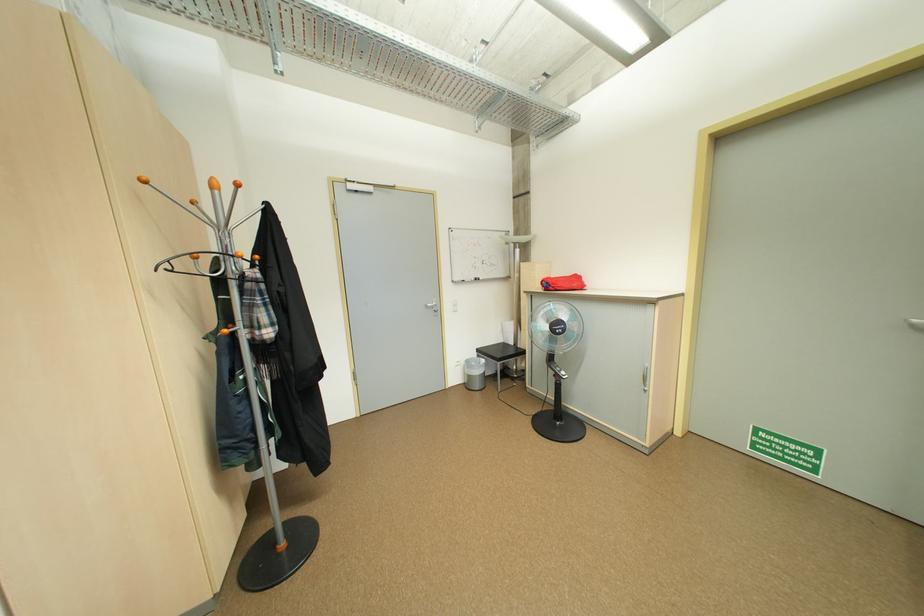
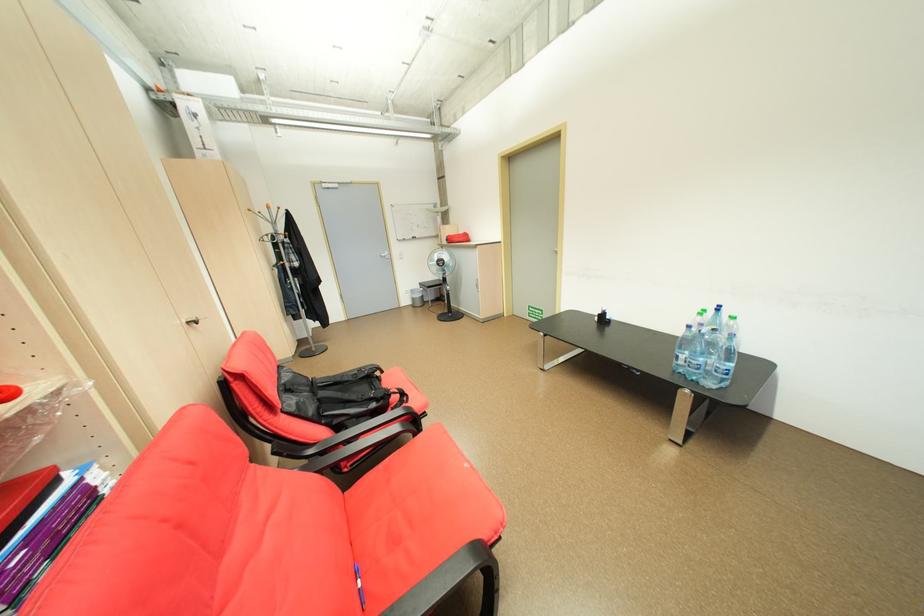
Looking at this image, the images are taken continuously from a first-person perspective. In which direction are you moving?

The cameraman moved toward right, backward.